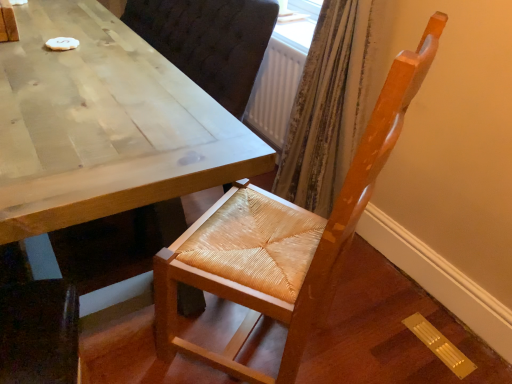
Question: Is light brown wooden table at center at the back of woven wood chair at center?

Choices:
 (A) yes
 (B) no

Answer: (B)

Question: Is woven wood chair at center far away from light brown wooden table at center?

Choices:
 (A) yes
 (B) no

Answer: (B)

Question: Can you confirm if woven wood chair at center is taller than light brown wooden table at center?

Choices:
 (A) yes
 (B) no

Answer: (A)

Question: Is woven wood chair at center thinner than light brown wooden table at center?

Choices:
 (A) yes
 (B) no

Answer: (A)

Question: Is woven wood chair at center closer to the viewer compared to light brown wooden table at center?

Choices:
 (A) no
 (B) yes

Answer: (B)

Question: Considering the relative positions of woven wood chair at center and light brown wooden table at center in the image provided, is woven wood chair at center behind light brown wooden table at center?

Choices:
 (A) yes
 (B) no

Answer: (B)

Question: Considering the relative positions of light brown wooden table at center and woven wood chair at center in the image provided, is light brown wooden table at center in front of woven wood chair at center?

Choices:
 (A) no
 (B) yes

Answer: (A)

Question: Could you tell me if light brown wooden table at center is turned towards woven wood chair at center?

Choices:
 (A) no
 (B) yes

Answer: (A)

Question: From the image's perspective, is light brown wooden table at center located above woven wood chair at center?

Choices:
 (A) no
 (B) yes

Answer: (B)

Question: Considering the relative sizes of light brown wooden table at center and woven wood chair at center in the image provided, is light brown wooden table at center wider than woven wood chair at center?

Choices:
 (A) no
 (B) yes

Answer: (B)

Question: Are light brown wooden table at center and woven wood chair at center far apart?

Choices:
 (A) yes
 (B) no

Answer: (B)

Question: Would you say light brown wooden table at center is outside woven wood chair at center?

Choices:
 (A) no
 (B) yes

Answer: (B)

Question: Is point (250, 148) positioned closer to the camera than point (302, 339)?

Choices:
 (A) farther
 (B) closer

Answer: (B)